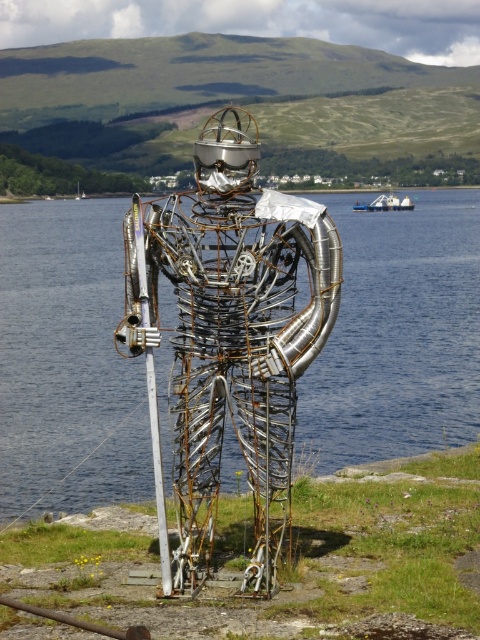
Is rusty metal sculpture at center taller than silver metallic pole at center?

Correct, rusty metal sculpture at center is much taller as silver metallic pole at center.

Measure the distance from rusty metal sculpture at center to silver metallic pole at center.

rusty metal sculpture at center and silver metallic pole at center are 3.20 meters apart.

Identify the location of rusty metal sculpture at center. (228, 339).

Is point (321, 404) less distant than point (228, 385)?

No, (321, 404) is behind (228, 385).

Is point (7, 442) farther from viewer compared to point (229, 378)?

Yes, it is.

You are a GUI agent. You are given a task and a screenshot of the screen. Output one action in this format:
    pyautogui.click(x=<x>, y=<y>)
    Task: Click on the blue metallic water at center
    
    Given the screenshot: What is the action you would take?
    pyautogui.click(x=67, y=362)

Who is positioned more to the left, blue metallic water at center or silver metallic pole at center?

blue metallic water at center

Measure the distance between point (348, 333) and camera.

The distance of point (348, 333) from camera is 88.23 feet.

This screenshot has width=480, height=640. Find the location of `blue metallic water at center`. blue metallic water at center is located at coordinates (67, 362).